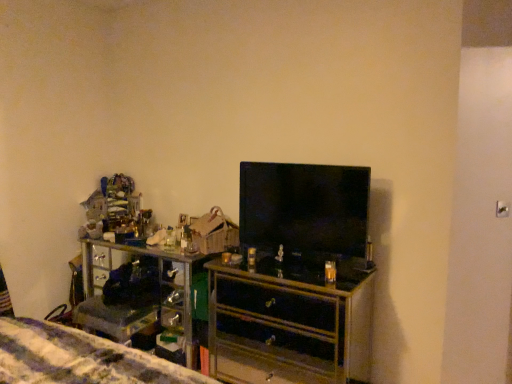
Question: Is black glossy tv at center taller than black glossy chest of drawers at center?

Choices:
 (A) yes
 (B) no

Answer: (B)

Question: Does black glossy tv at center have a larger size compared to black glossy chest of drawers at center?

Choices:
 (A) no
 (B) yes

Answer: (A)

Question: Can you confirm if black glossy tv at center is shorter than black glossy chest of drawers at center?

Choices:
 (A) yes
 (B) no

Answer: (A)

Question: From the image's perspective, is black glossy tv at center below black glossy chest of drawers at center?

Choices:
 (A) yes
 (B) no

Answer: (B)

Question: From a real-world perspective, is black glossy tv at center beneath black glossy chest of drawers at center?

Choices:
 (A) yes
 (B) no

Answer: (B)

Question: Is black glossy chest of drawers at center completely or partially inside black glossy tv at center?

Choices:
 (A) yes
 (B) no

Answer: (B)

Question: Is black glossy chest of drawers at center oriented away from black glossy tv at center?

Choices:
 (A) yes
 (B) no

Answer: (B)

Question: Can you confirm if black glossy chest of drawers at center is taller than black glossy tv at center?

Choices:
 (A) no
 (B) yes

Answer: (B)

Question: Considering the relative sizes of black glossy chest of drawers at center and black glossy tv at center in the image provided, is black glossy chest of drawers at center bigger than black glossy tv at center?

Choices:
 (A) yes
 (B) no

Answer: (A)

Question: Is black glossy chest of drawers at center wider than black glossy tv at center?

Choices:
 (A) yes
 (B) no

Answer: (A)

Question: Is black glossy chest of drawers at center completely or partially outside of black glossy tv at center?

Choices:
 (A) no
 (B) yes

Answer: (B)

Question: Is black glossy tv at center located within black glossy chest of drawers at center?

Choices:
 (A) no
 (B) yes

Answer: (A)

Question: Considering the relative positions of black glossy chest of drawers at center and black glossy tv at center in the image provided, is black glossy chest of drawers at center to the left or to the right of black glossy tv at center?

Choices:
 (A) left
 (B) right

Answer: (A)